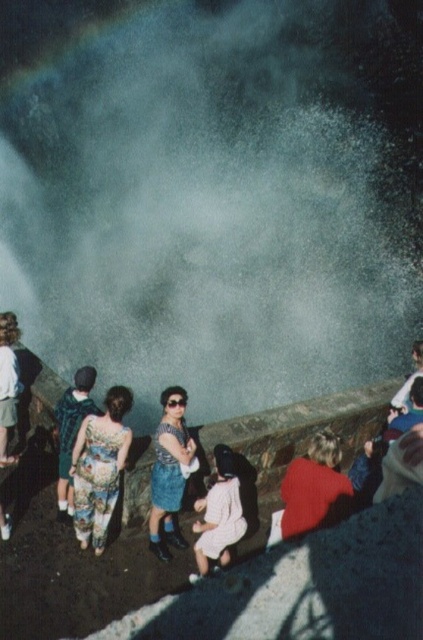
Question: Does white mist at center have a lesser width compared to white satin dress at center?

Choices:
 (A) yes
 (B) no

Answer: (B)

Question: Which of these objects is positioned closest to the white cotton shirt at lower left?

Choices:
 (A) white satin dress at center
 (B) white mist at center
 (C) denim skirt at center
 (D) floral fabric dress at center

Answer: (D)

Question: In this image, where is white satin dress at center located relative to white cotton shirt at lower left?

Choices:
 (A) right
 (B) left

Answer: (A)

Question: Does floral fabric dress at center appear under denim skirt at center?

Choices:
 (A) yes
 (B) no

Answer: (B)

Question: Estimate the real-world distances between objects in this image. Which object is closer to the floral fabric dress at lower left?

Choices:
 (A) white cotton shirt at lower left
 (B) white satin dress at center

Answer: (A)

Question: Which point is closer to the camera?

Choices:
 (A) 60,452
 (B) 186,464

Answer: (B)